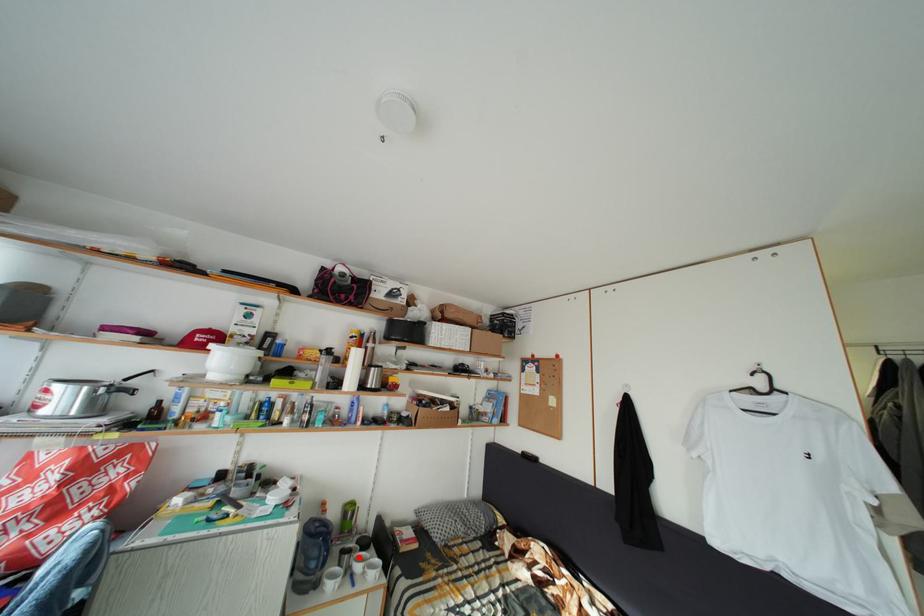
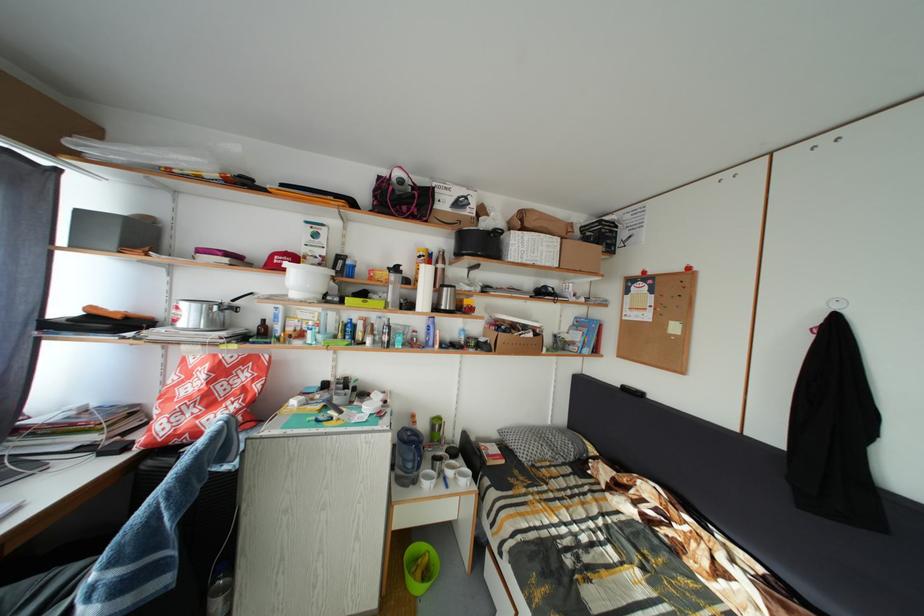
Where in the second image is the point corresponding to the highlighted location from the first image?

(450, 464)